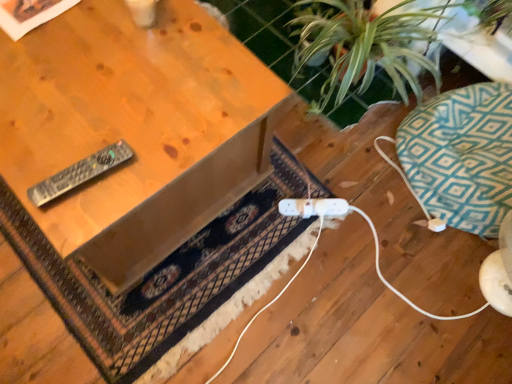
Identify the location of vacant space in front of teal geometric cushion at right. This screenshot has height=384, width=512. (411, 298).